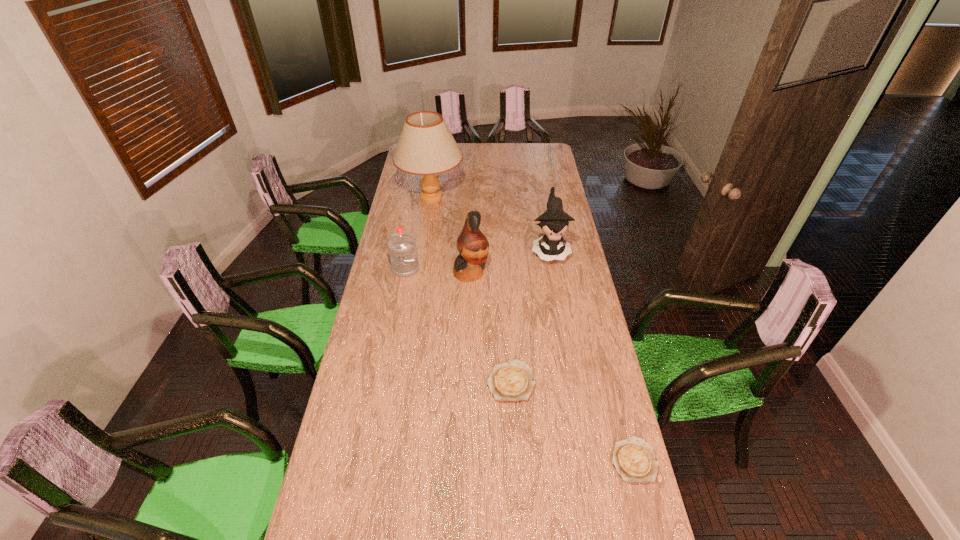
Identify the location of vacant space located on the back of the shorter quiche. Image resolution: width=960 pixels, height=540 pixels. (615, 390).

The image size is (960, 540). What are the coordinates of `vacant space located 0.110m on the back of the farthest object` in the screenshot? It's located at pos(435,172).

The width and height of the screenshot is (960, 540). Find the location of `free space located on the handle side of the third shortest object`. free space located on the handle side of the third shortest object is located at coordinates click(393, 336).

Where is `free space located 0.200m on the face of the second tallest object`? The image size is (960, 540). free space located 0.200m on the face of the second tallest object is located at coordinates (534, 273).

Where is `blank area located at the face of the doll`? blank area located at the face of the doll is located at coordinates (557, 290).

I want to click on object that is at the near edge, so click(634, 459).

Locate an element on the screen. lampshade that is at the left edge is located at coordinates (426, 146).

The image size is (960, 540). Find the location of `water bottle located in the left edge section of the desktop`. water bottle located in the left edge section of the desktop is located at coordinates (402, 250).

Where is `quiche at the right edge`? quiche at the right edge is located at coordinates (634, 459).

Image resolution: width=960 pixels, height=540 pixels. I want to click on doll positioned at the right edge, so click(x=555, y=221).